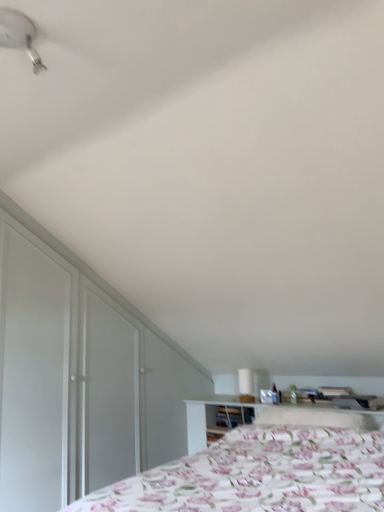
The width and height of the screenshot is (384, 512). What do you see at coordinates (19, 35) in the screenshot?
I see `white plastic fan at upper left` at bounding box center [19, 35].

In order to face floral fabric bed at lower right, should I rotate leftwards or rightwards?

Turn right by 9.785 degrees to look at floral fabric bed at lower right.

In order to click on white plastic fan at upper left in this screenshot , I will do `click(19, 35)`.

Between white glossy dresser at left and floral fabric bed at lower right, which one has smaller width?

white glossy dresser at left is thinner.

Where is `bed on the right of white glossy dresser at left`? bed on the right of white glossy dresser at left is located at coordinates (266, 468).

Which object is closer to the camera taking this photo, white glossy dresser at left or floral fabric bed at lower right?

floral fabric bed at lower right is closer to the camera.

Locate an element on the screen. fan above the white glossy table lamp at upper center (from a real-world perspective) is located at coordinates (19, 35).

Which of these two, white glossy table lamp at upper center or white plastic fan at upper left, stands taller?

white glossy table lamp at upper center.

From a real-world perspective, is white glossy table lamp at upper center positioned above or below white plastic fan at upper left?

From a real-world perspective, white glossy table lamp at upper center is physically below white plastic fan at upper left.

Considering the sizes of objects white glossy table lamp at upper center and white plastic fan at upper left in the image provided, who is wider, white glossy table lamp at upper center or white plastic fan at upper left?

white plastic fan at upper left.

In the scene shown: From a real-world perspective, relative to white plastic fan at upper left, is fluffy white pillow at center vertically above or below?

fluffy white pillow at center is below white plastic fan at upper left.

Based on the photo, which of these two, fluffy white pillow at center or white plastic fan at upper left, is smaller?

Smaller between the two is white plastic fan at upper left.

Is fluffy white pillow at center shorter than white plastic fan at upper left?

Indeed, fluffy white pillow at center has a lesser height compared to white plastic fan at upper left.

Visually, is fluffy white pillow at center positioned to the left or to the right of white plastic fan at upper left?

fluffy white pillow at center is positioned on white plastic fan at upper left's right side.

Considering the sizes of objects fluffy white pillow at center and white glossy table lamp at upper center in the image provided, who is taller, fluffy white pillow at center or white glossy table lamp at upper center?

Standing taller between the two is white glossy table lamp at upper center.

Based on the photo, from a real-world perspective, relative to white glossy table lamp at upper center, is fluffy white pillow at center vertically above or below?

From a real-world perspective, fluffy white pillow at center is physically below white glossy table lamp at upper center.

Can we say fluffy white pillow at center lies outside white glossy table lamp at upper center?

Indeed, fluffy white pillow at center is completely outside white glossy table lamp at upper center.

Is point (381, 476) in front of point (333, 424)?

Yes, it is.

Can you confirm if floral fabric bed at lower right is bigger than fluffy white pillow at center?

Indeed, floral fabric bed at lower right has a larger size compared to fluffy white pillow at center.

Between floral fabric bed at lower right and fluffy white pillow at center, which one has smaller width?

With smaller width is fluffy white pillow at center.

This screenshot has width=384, height=512. In order to click on fan on the left of the white glossy dresser at left in this screenshot , I will do `click(19, 35)`.

Based on the photo, is white plastic fan at upper left at the back of white glossy dresser at left?

white glossy dresser at left does not have its back to white plastic fan at upper left.

Which object is closer to the camera, white glossy dresser at left or white plastic fan at upper left?

white plastic fan at upper left is more forward.

Does white glossy dresser at left have a greater width compared to white plastic fan at upper left?

Incorrect, the width of white glossy dresser at left does not surpass that of white plastic fan at upper left.

From a real-world perspective, is white glossy table lamp at upper center positioned over white glossy dresser at left based on gravity?

No.

Does white glossy table lamp at upper center have a smaller size compared to white glossy dresser at left?

Correct, white glossy table lamp at upper center occupies less space than white glossy dresser at left.

Is white glossy table lamp at upper center positioned with its back to white glossy dresser at left?

That's not correct — white glossy table lamp at upper center is not looking away from white glossy dresser at left.

Does white glossy table lamp at upper center appear on the right side of white glossy dresser at left?

Yes.

Where is `bed that appears on the right of white glossy dresser at left`? The width and height of the screenshot is (384, 512). bed that appears on the right of white glossy dresser at left is located at coordinates (266, 468).

Identify the location of table lamp below the white plastic fan at upper left (from the image's perspective). (246, 386).

Looking at the image, which one is located closer to fluffy white pillow at center, white glossy table lamp at upper center or white plastic fan at upper left?

white glossy table lamp at upper center is closer to fluffy white pillow at center.

Based on their spatial positions, is white plastic fan at upper left or floral fabric bed at lower right closer to fluffy white pillow at center?

The object closer to fluffy white pillow at center is floral fabric bed at lower right.

From the image, which object appears to be farther from floral fabric bed at lower right, white glossy table lamp at upper center or white plastic fan at upper left?

Among the two, white plastic fan at upper left is located further to floral fabric bed at lower right.

Which object lies further to the anchor point white glossy dresser at left, white plastic fan at upper left or fluffy white pillow at center?

white plastic fan at upper left.

When comparing their distances from white plastic fan at upper left, does white glossy table lamp at upper center or floral fabric bed at lower right seem closer?

floral fabric bed at lower right is closer to white plastic fan at upper left.

Looking at the image, which one is located further to white glossy table lamp at upper center, white glossy dresser at left or floral fabric bed at lower right?

floral fabric bed at lower right.

Based on their spatial positions, is floral fabric bed at lower right or fluffy white pillow at center closer to white glossy dresser at left?

floral fabric bed at lower right lies closer to white glossy dresser at left than the other object.

Considering their positions, is fluffy white pillow at center positioned further to floral fabric bed at lower right than white glossy table lamp at upper center?

Among the two, white glossy table lamp at upper center is located further to floral fabric bed at lower right.

Find the location of `dresser between white plastic fan at upper left and white glossy table lamp at upper center in the front-back direction`. dresser between white plastic fan at upper left and white glossy table lamp at upper center in the front-back direction is located at coordinates (78, 382).

What are the coordinates of `pillow located between floral fabric bed at lower right and white glossy table lamp at upper center in the depth direction` in the screenshot? It's located at (311, 417).

Find the location of a particular element. dresser between floral fabric bed at lower right and fluffy white pillow at center along the z-axis is located at coordinates (78, 382).

Find the location of a particular element. The height and width of the screenshot is (512, 384). table lamp between white glossy dresser at left and fluffy white pillow at center from left to right is located at coordinates (246, 386).